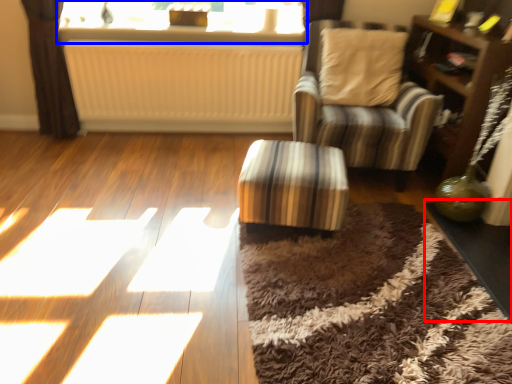
Question: Which object is closer to the camera taking this photo, table (highlighted by a red box) or window (highlighted by a blue box)?

Choices:
 (A) table
 (B) window

Answer: (A)